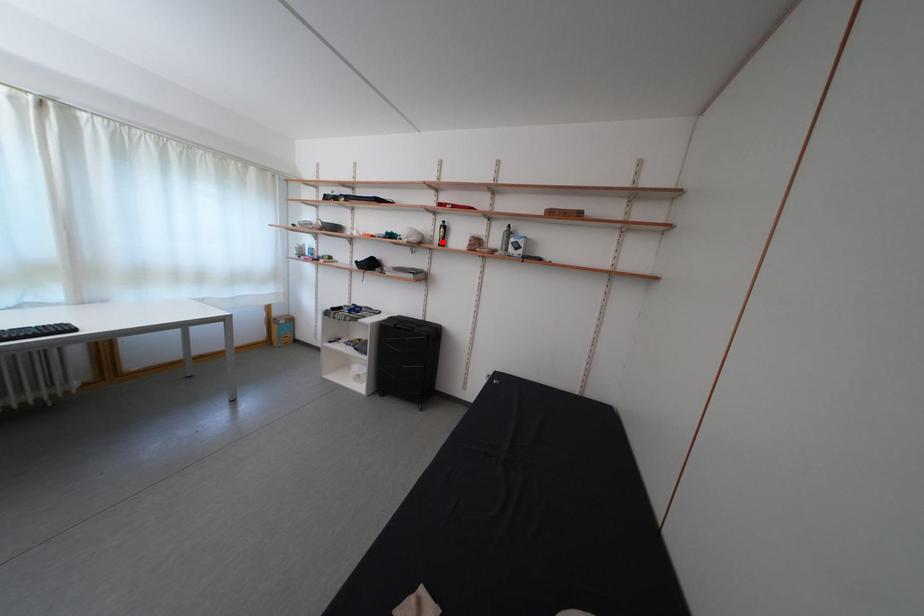
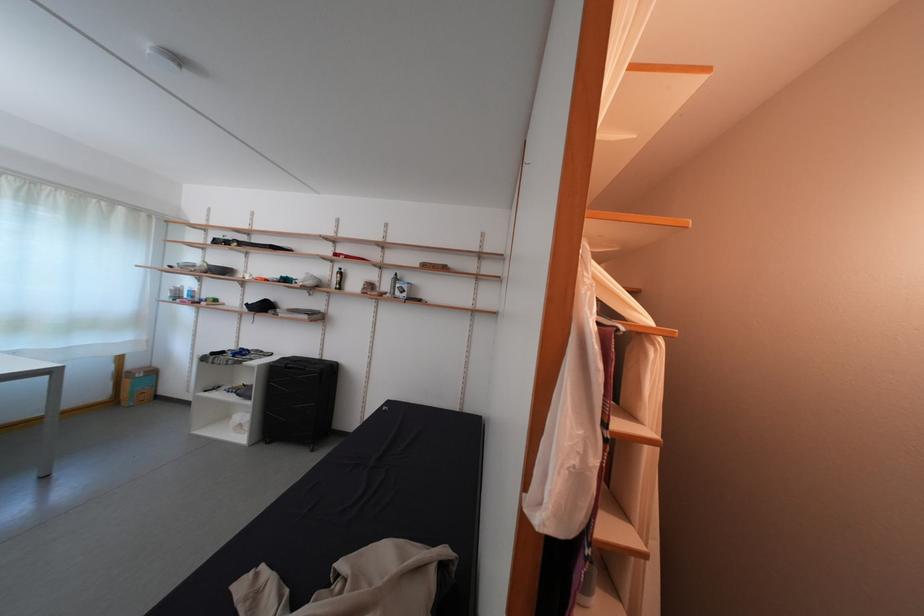
In the second image, find the point that corresponds to the highlighted location in the first image.

(339, 286)